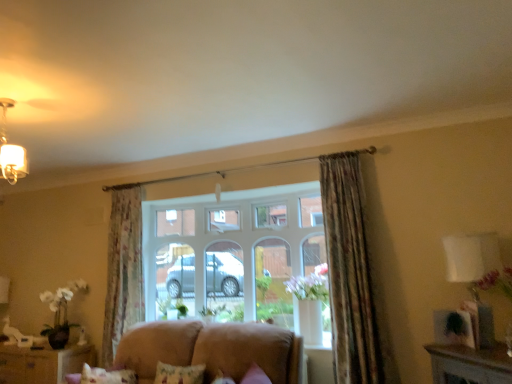
Question: Is brown wooden cabinet at lower left in front of floral fabric curtain at left, the 1th curtain from the back?

Choices:
 (A) yes
 (B) no

Answer: (B)

Question: Does brown wooden cabinet at lower left turn towards floral fabric curtain at left, the 1th curtain positioned from the left?

Choices:
 (A) yes
 (B) no

Answer: (B)

Question: Is brown wooden cabinet at lower left bigger than floral fabric curtain at left, the 1th curtain from the back?

Choices:
 (A) no
 (B) yes

Answer: (B)

Question: Is brown wooden cabinet at lower left completely or partially outside of floral fabric curtain at left, the 2th curtain from the front?

Choices:
 (A) no
 (B) yes

Answer: (B)

Question: Is brown wooden cabinet at lower left turned away from floral fabric curtain at left, the second curtain positioned from the right?

Choices:
 (A) yes
 (B) no

Answer: (B)

Question: Is fluffy pink pillow at lower center in front of or behind brown wooden cabinet at lower left in the image?

Choices:
 (A) front
 (B) behind

Answer: (A)

Question: Considering the positions of fluffy pink pillow at lower center and brown wooden cabinet at lower left in the image, is fluffy pink pillow at lower center bigger or smaller than brown wooden cabinet at lower left?

Choices:
 (A) small
 (B) big

Answer: (A)

Question: Looking at their shapes, would you say fluffy pink pillow at lower center is wider or thinner than brown wooden cabinet at lower left?

Choices:
 (A) wide
 (B) thin

Answer: (B)

Question: Considering the positions of fluffy pink pillow at lower center and brown wooden cabinet at lower left in the image, is fluffy pink pillow at lower center taller or shorter than brown wooden cabinet at lower left?

Choices:
 (A) tall
 (B) short

Answer: (B)

Question: From the image's perspective, is floral fabric curtain at left, the 1th curtain from the back, above or below brown wooden cabinet at lower left?

Choices:
 (A) below
 (B) above

Answer: (B)

Question: In terms of width, does floral fabric curtain at left, the 2th curtain from the front, look wider or thinner when compared to brown wooden cabinet at lower left?

Choices:
 (A) thin
 (B) wide

Answer: (A)

Question: Considering their positions, is floral fabric curtain at left, the 2th curtain from the front, located in front of or behind brown wooden cabinet at lower left?

Choices:
 (A) behind
 (B) front

Answer: (B)

Question: Is point (141, 286) closer or farther from the camera than point (59, 379)?

Choices:
 (A) closer
 (B) farther

Answer: (B)

Question: Is suede-like beige sofa at lower center situated inside floral fabric curtain at upper right, arranged as the first curtain when viewed from the right, or outside?

Choices:
 (A) outside
 (B) inside

Answer: (A)

Question: Is point (231, 334) closer or farther from the camera than point (331, 342)?

Choices:
 (A) farther
 (B) closer

Answer: (B)